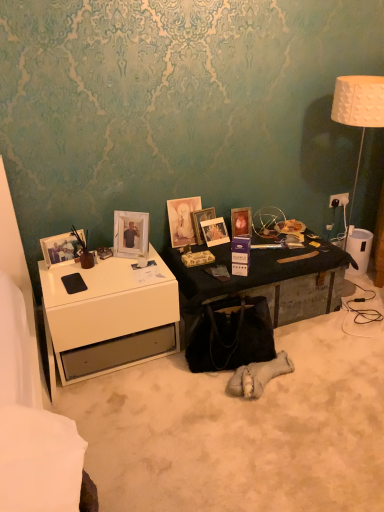
Locate an element on the screen. The height and width of the screenshot is (512, 384). free location in front of black suede handbag at center is located at coordinates (235, 418).